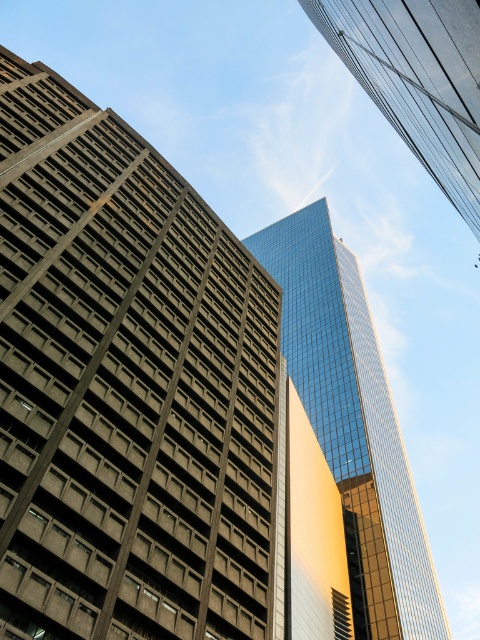
Is point (19, 81) in front of point (437, 600)?

Yes, point (19, 81) is closer to viewer.

What are the coordinates of `gray concrete building at left` in the screenshot? It's located at (127, 387).

Locate an element on the screen. Image resolution: width=480 pixels, height=640 pixels. gray concrete building at left is located at coordinates (127, 387).

Identify the location of gray concrete building at left. This screenshot has width=480, height=640. (127, 387).

Is glassy reflective skyscraper at center behind glassy reflective skyscraper at upper center?

Yes, glassy reflective skyscraper at center is behind glassy reflective skyscraper at upper center.

Does glassy reflective skyscraper at center appear over glassy reflective skyscraper at upper center?

No.

Who is more forward, (349, 456) or (453, 102)?

Point (453, 102)

The height and width of the screenshot is (640, 480). In order to click on glassy reflective skyscraper at center in this screenshot , I will do `click(352, 424)`.

Does gray concrete building at left have a greater width compared to glassy reflective skyscraper at upper center?

Yes, gray concrete building at left is wider than glassy reflective skyscraper at upper center.

Can you confirm if gray concrete building at left is positioned to the left of glassy reflective skyscraper at upper center?

Correct, you'll find gray concrete building at left to the left of glassy reflective skyscraper at upper center.

Measure the distance between gray concrete building at left and camera.

gray concrete building at left is 22.41 meters from camera.

Identify the location of gray concrete building at left. Image resolution: width=480 pixels, height=640 pixels. (127, 387).